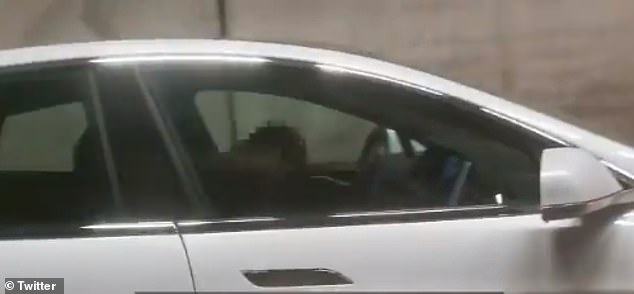
Identify the location of chrome trim. (598, 204), (437, 211), (119, 228).